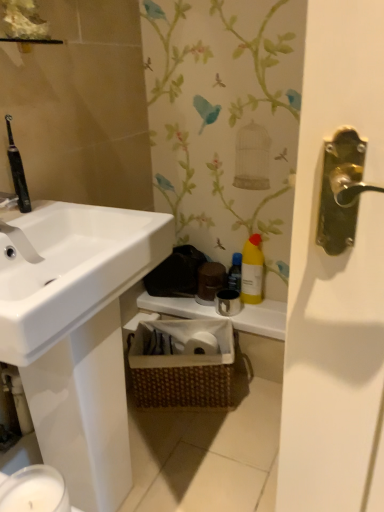
Find the location of a particular element. vacant area that is in front of yellow plastic bottle at upper right is located at coordinates (264, 312).